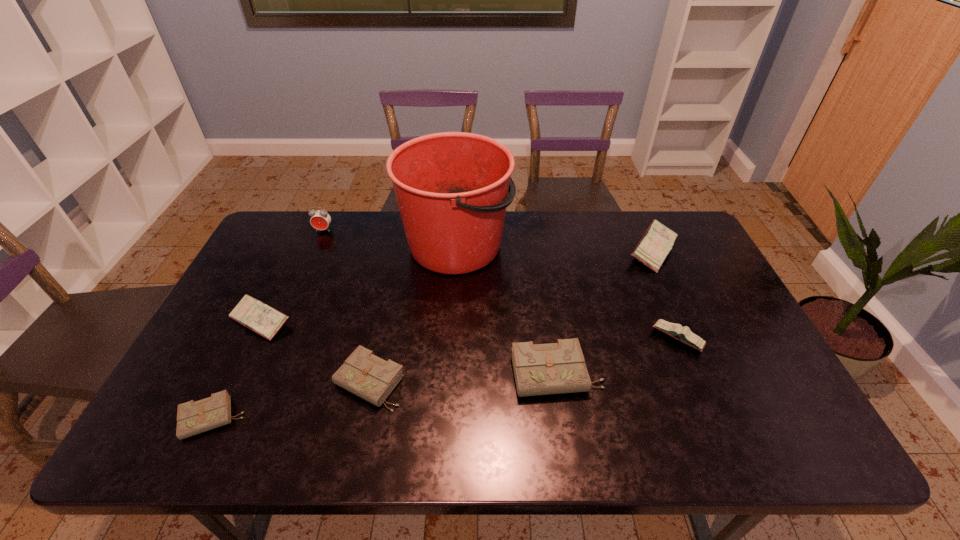
At what (x,y) coordinates should I click in order to perform the action: click on free space at the far edge of the desktop. Please return your answer as a coordinate pair (x, y). The width and height of the screenshot is (960, 540). Looking at the image, I should click on (395, 226).

In the image, there is a desktop. Find the location of `vacant space at the near edge`. vacant space at the near edge is located at coordinates (584, 418).

Find the location of a particular element. vacant space at the left edge is located at coordinates (255, 364).

Locate an element on the screen. The image size is (960, 540). vacant space at the right edge of the desktop is located at coordinates (692, 312).

Where is `free space at the far left corner of the desktop`? The height and width of the screenshot is (540, 960). free space at the far left corner of the desktop is located at coordinates (284, 253).

The height and width of the screenshot is (540, 960). In order to click on free space between the tallest diary and the shortest diary in this screenshot , I will do `click(433, 334)`.

You are a GUI agent. You are given a task and a screenshot of the screen. Output one action in this format:
    pyautogui.click(x=<x>, y=<y>)
    Task: Click on the vacant space that is in between the second smallest pink diary and the red alarm clock
    
    Given the screenshot: What is the action you would take?
    pyautogui.click(x=292, y=275)

Locate an element on the screen. vacant region between the alarm clock and the smallest pink diary is located at coordinates (501, 284).

Find the location of a particular element. This screenshot has height=540, width=960. vacant space that is in between the biggest pink diary and the bucket is located at coordinates (555, 247).

Image resolution: width=960 pixels, height=540 pixels. I want to click on vacant space in between the shortest object and the sixth shortest object, so click(433, 334).